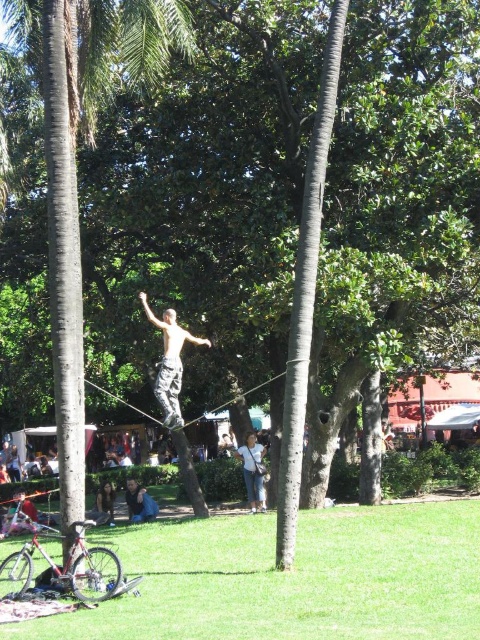
Question: Observing the image, what is the correct spatial positioning of green textured palm tree at center in reference to shiny silver pants at center?

Choices:
 (A) below
 (B) above

Answer: (B)

Question: Does shiny silver pants at center have a smaller size compared to light brown hair at lower left?

Choices:
 (A) yes
 (B) no

Answer: (A)

Question: Which point is farther to the camera?

Choices:
 (A) shiny silver pants at center
 (B) blue denim jeans at lower left

Answer: (B)

Question: Which point is closer to the camera?

Choices:
 (A) click(98, 8)
 (B) click(179, 365)
 (C) click(147, 513)
 (D) click(260, 508)

Answer: (B)

Question: Can you confirm if green textured palm tree at center is smaller than light brown hair at lower left?

Choices:
 (A) yes
 (B) no

Answer: (B)

Question: Which object is the farthest from the light brown hair at lower left?

Choices:
 (A) green textured palm tree at center
 (B) denim pants at center

Answer: (A)